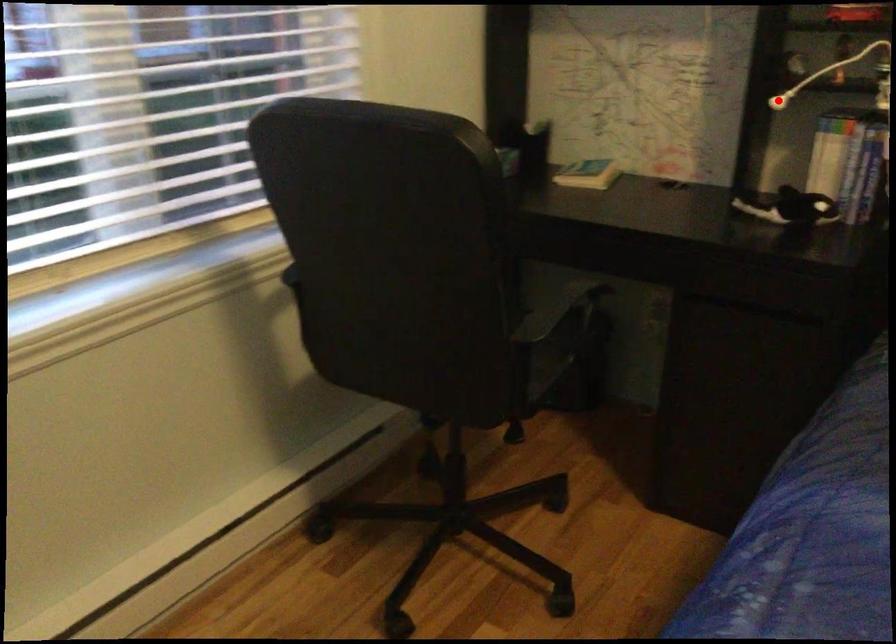
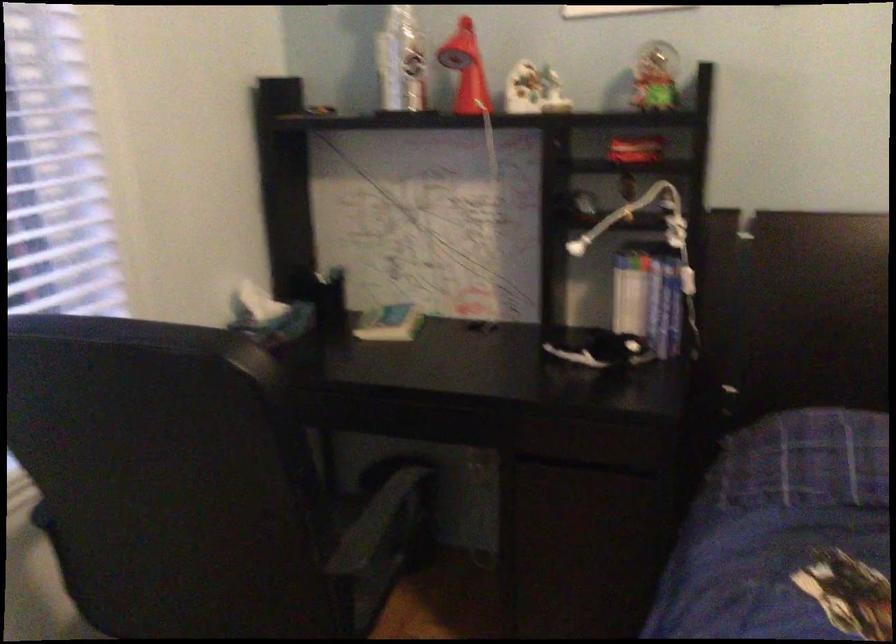
Locate, in the second image, the point that corresponds to the highlighted location in the first image.

(576, 247)